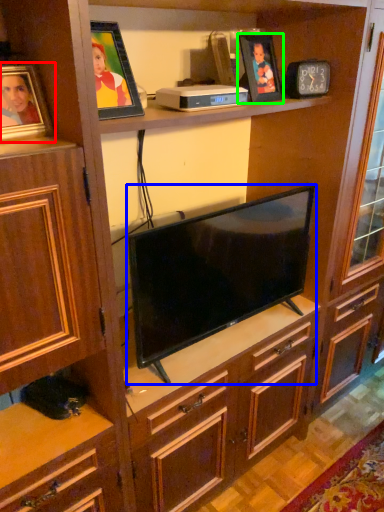
Question: Which object is positioned farthest from picture frame (highlighted by a red box)? Select from television (highlighted by a blue box) and picture frame (highlighted by a green box).

Choices:
 (A) television
 (B) picture frame

Answer: (B)